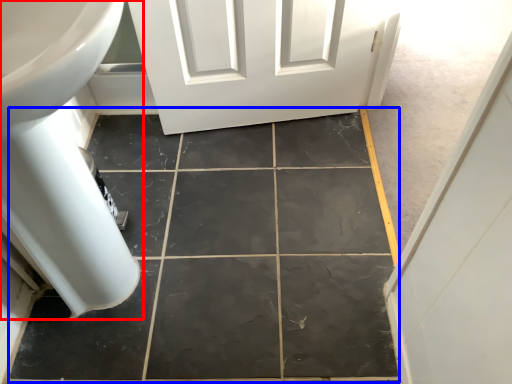
Question: Which point is further to the camera, bath (highlighted by a red box) or ceramic tile (highlighted by a blue box)?

Choices:
 (A) bath
 (B) ceramic tile

Answer: (B)